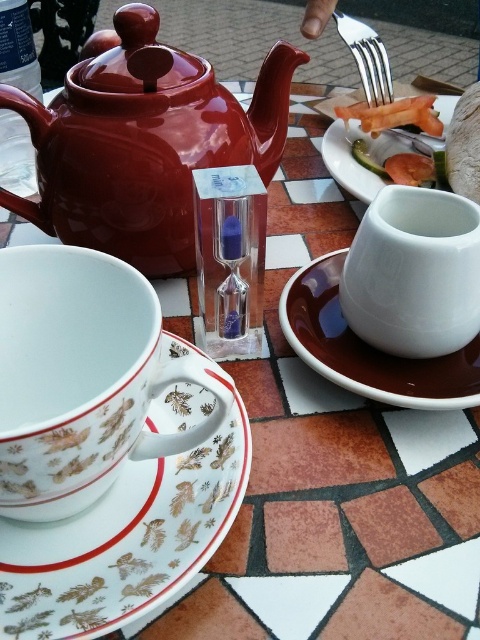
Which is in front, point (83, 561) or point (464, 275)?

Positioned in front is point (83, 561).

Can you confirm if white porcelain plate at lower left is shorter than white glossy teacup at center?

Incorrect, white porcelain plate at lower left's height does not fall short of white glossy teacup at center's.

Is point (58, 529) farther from viewer compared to point (439, 307)?

No.

In order to click on white porcelain plate at lower left in this screenshot , I will do `click(123, 541)`.

What do you see at coordinates (369, 348) in the screenshot? I see `brown ceramic saucer at center` at bounding box center [369, 348].

Does point (325, 332) lie in front of point (362, 170)?

Yes.

This screenshot has width=480, height=640. In order to click on brown ceramic saucer at center in this screenshot , I will do `click(369, 348)`.

Between white porcelain teacup at center and white porcelain plate at lower left, which one has less height?

white porcelain plate at lower left

Does white porcelain teacup at center have a greater height compared to white porcelain plate at lower left?

Correct, white porcelain teacup at center is much taller as white porcelain plate at lower left.

The height and width of the screenshot is (640, 480). I want to click on white porcelain teacup at center, so click(82, 378).